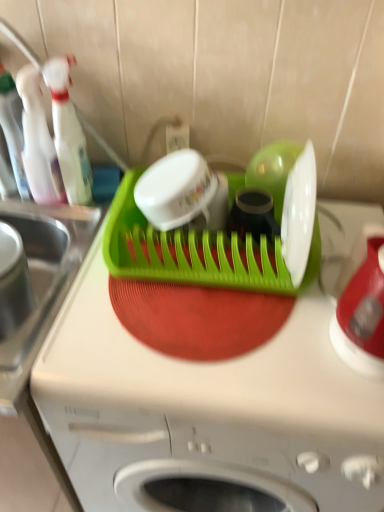
The width and height of the screenshot is (384, 512). What do you see at coordinates (207, 413) in the screenshot? I see `green plastic dish rack at center` at bounding box center [207, 413].

The image size is (384, 512). Describe the element at coordinates (212, 237) in the screenshot. I see `green plastic dish rack at center, placed as the second appliance when sorted from right to left` at that location.

In order to face green plastic dish rack at center, placed as the second appliance when sorted from right to left, should I rotate leftwards or rightwards?

To face it directly, rotate right by 3.211 degrees.

This screenshot has width=384, height=512. Describe the element at coordinates (68, 132) in the screenshot. I see `transparent plastic spray bottle at upper left, which ranks as the 3th bottle in left-to-right order` at that location.

Identify the location of transparent plastic spray bottle at upper left, the first bottle viewed from the right. pos(68,132).

What do you see at coordinates (362, 313) in the screenshot?
I see `red glossy kettle at right, placed as the 1th appliance when sorted from right to left` at bounding box center [362, 313].

Where is `red glossy kettle at right, placed as the 1th appliance when sorted from right to left`? This screenshot has width=384, height=512. red glossy kettle at right, placed as the 1th appliance when sorted from right to left is located at coordinates (362, 313).

Find the location of a particular element. The image size is (384, 512). brushed metal sink at left is located at coordinates (46, 264).

Measure the distance from green plastic dish rack at center to transparent plastic spray bottle at upper left, which ranks as the 3th bottle in left-to-right order.

A distance of 50.55 centimeters exists between green plastic dish rack at center and transparent plastic spray bottle at upper left, which ranks as the 3th bottle in left-to-right order.

From a real-world perspective, is green plastic dish rack at center under transparent plastic spray bottle at upper left, the first bottle viewed from the right?

Yes, from a real-world perspective, green plastic dish rack at center is under transparent plastic spray bottle at upper left, the first bottle viewed from the right.

Is green plastic dish rack at center not close to transparent plastic spray bottle at upper left, which ranks as the 3th bottle in left-to-right order?

No, there isn't a large distance between green plastic dish rack at center and transparent plastic spray bottle at upper left, which ranks as the 3th bottle in left-to-right order.

Is green plastic dish rack at center to the left or to the right of transparent plastic spray bottle at upper left, the first bottle viewed from the right, in the image?

green plastic dish rack at center is to the right of transparent plastic spray bottle at upper left, the first bottle viewed from the right.

Looking at this image, from a real-world perspective, who is located higher, green plastic dish rack at center, placed as the second appliance when sorted from right to left, or translucent plastic bottle at left, which is the second bottle from left to right?

In real-world perspective, translucent plastic bottle at left, which is the second bottle from left to right, is above.

Does green plastic dish rack at center, the 1th appliance positioned from the left, have a lesser width compared to translucent plastic bottle at left, which is the second bottle from left to right?

Incorrect, the width of green plastic dish rack at center, the 1th appliance positioned from the left, is not less than that of translucent plastic bottle at left, which is the second bottle from left to right.

Does green plastic dish rack at center, placed as the second appliance when sorted from right to left, have a larger size compared to translucent plastic bottle at left, which is counted as the second bottle, starting from the right?

Yes.

Where is `the 2nd appliance directly beneath the translucent plastic bottle at left, which is the second bottle from left to right (from a real-world perspective)`? The image size is (384, 512). the 2nd appliance directly beneath the translucent plastic bottle at left, which is the second bottle from left to right (from a real-world perspective) is located at coordinates (212, 237).

What's the angular difference between brushed metal sink at left and green plastic dish rack at center's facing directions?

The angular difference between brushed metal sink at left and green plastic dish rack at center is 0.000469 degrees.

Does point (13, 357) appear closer or farther from the camera than point (337, 432)?

Point (13, 357) appears to be farther away from the viewer than point (337, 432).

Does brushed metal sink at left turn towards green plastic dish rack at center?

No, brushed metal sink at left is not facing towards green plastic dish rack at center.

Is brushed metal sink at left next to green plastic dish rack at center?

No, brushed metal sink at left is not beside green plastic dish rack at center.

Which of these two, translucent plastic bottle at left, which is counted as the second bottle, starting from the right, or transparent plastic spray bottle at upper left, which ranks as the 3th bottle in left-to-right order, stands shorter?

translucent plastic bottle at left, which is counted as the second bottle, starting from the right.

Is translucent plastic bottle at left, which is the second bottle from left to right, far away from transparent plastic spray bottle at upper left, the first bottle viewed from the right?

No, there isn't a large distance between translucent plastic bottle at left, which is the second bottle from left to right, and transparent plastic spray bottle at upper left, the first bottle viewed from the right.

Is transparent plastic spray bottle at upper left, which ranks as the 3th bottle in left-to-right order, at the back of translucent plastic bottle at left, which is counted as the second bottle, starting from the right?

No, transparent plastic spray bottle at upper left, which ranks as the 3th bottle in left-to-right order, is not at the back of translucent plastic bottle at left, which is counted as the second bottle, starting from the right.

Does point (77, 195) appear closer or farther from the camera than point (376, 257)?

Point (77, 195) is farther from the camera than point (376, 257).

What's the angular difference between transparent plastic spray bottle at upper left, which ranks as the 3th bottle in left-to-right order, and red glossy kettle at right, placed as the 1th appliance when sorted from right to left,'s facing directions?

The angular difference between transparent plastic spray bottle at upper left, which ranks as the 3th bottle in left-to-right order, and red glossy kettle at right, placed as the 1th appliance when sorted from right to left, is 0.14 degrees.

Relative to red glossy kettle at right, the 2th appliance positioned from the left, is transparent plastic spray bottle at upper left, which ranks as the 3th bottle in left-to-right order, in front or behind?

transparent plastic spray bottle at upper left, which ranks as the 3th bottle in left-to-right order, is behind red glossy kettle at right, the 2th appliance positioned from the left.

Looking at this image, from the image's perspective, is transparent plastic spray bottle at upper left, which ranks as the 3th bottle in left-to-right order, located beneath red glossy kettle at right, the 2th appliance positioned from the left?

Actually, transparent plastic spray bottle at upper left, which ranks as the 3th bottle in left-to-right order, appears above red glossy kettle at right, the 2th appliance positioned from the left, in the image.

Can you confirm if transparent plastic spray bottle at upper left, which ranks as the 3th bottle in left-to-right order, is thinner than translucent plastic bottle at left, which is counted as the second bottle, starting from the right?

No, transparent plastic spray bottle at upper left, which ranks as the 3th bottle in left-to-right order, is not thinner than translucent plastic bottle at left, which is counted as the second bottle, starting from the right.

Looking at the image, does transparent plastic spray bottle at upper left, which ranks as the 3th bottle in left-to-right order, seem bigger or smaller compared to translucent plastic bottle at left, which is the second bottle from left to right?

transparent plastic spray bottle at upper left, which ranks as the 3th bottle in left-to-right order, is bigger than translucent plastic bottle at left, which is the second bottle from left to right.

Where is `bottle that is in front of the translucent plastic bottle at left, which is the second bottle from left to right`? Image resolution: width=384 pixels, height=512 pixels. bottle that is in front of the translucent plastic bottle at left, which is the second bottle from left to right is located at coordinates click(68, 132).

From the image's perspective, which one is positioned lower, transparent plastic bottle at left, the third bottle positioned from the right, or translucent plastic bottle at left, which is counted as the second bottle, starting from the right?

translucent plastic bottle at left, which is counted as the second bottle, starting from the right.

Where is `bottle behind the translucent plastic bottle at left, which is counted as the second bottle, starting from the right`? The width and height of the screenshot is (384, 512). bottle behind the translucent plastic bottle at left, which is counted as the second bottle, starting from the right is located at coordinates (13, 129).

From the picture: Is transparent plastic bottle at left, the third bottle positioned from the right, behind translucent plastic bottle at left, which is counted as the second bottle, starting from the right?

That is True.

From the picture: How different are the orientations of transparent plastic bottle at left, arranged as the 1th bottle when viewed from the left, and translucent plastic bottle at left, which is counted as the second bottle, starting from the right, in degrees?

0.000612 degrees.

In order to click on bottle that is the 1st one when counting backward from the green plastic dish rack at center in this screenshot , I will do `click(68, 132)`.

Locate an element on the screen. The width and height of the screenshot is (384, 512). appliance that is the 1st one when counting downward from the translucent plastic bottle at left, which is the second bottle from left to right (from the image's perspective) is located at coordinates (212, 237).

Estimate the real-world distances between objects in this image. Which object is closer to brushed metal sink at left, transparent plastic bottle at left, arranged as the 1th bottle when viewed from the left, or red glossy kettle at right, the 2th appliance positioned from the left?

Based on the image, transparent plastic bottle at left, arranged as the 1th bottle when viewed from the left, appears to be nearer to brushed metal sink at left.

Looking at the image, which one is located closer to transparent plastic bottle at left, arranged as the 1th bottle when viewed from the left, transparent plastic spray bottle at upper left, the first bottle viewed from the right, or green plastic dish rack at center, the 1th appliance positioned from the left?

transparent plastic spray bottle at upper left, the first bottle viewed from the right.

Considering their positions, is red glossy kettle at right, placed as the 1th appliance when sorted from right to left, positioned closer to brushed metal sink at left than transparent plastic bottle at left, the third bottle positioned from the right?

Based on the image, transparent plastic bottle at left, the third bottle positioned from the right, appears to be nearer to brushed metal sink at left.

Which object lies nearer to the anchor point green plastic dish rack at center, the 1th appliance positioned from the left, transparent plastic bottle at left, the third bottle positioned from the right, or brushed metal sink at left?

Among the two, brushed metal sink at left is located nearer to green plastic dish rack at center, the 1th appliance positioned from the left.

When comparing their distances from brushed metal sink at left, does green plastic dish rack at center, placed as the second appliance when sorted from right to left, or transparent plastic spray bottle at upper left, the first bottle viewed from the right, seem further?

Among the two, green plastic dish rack at center, placed as the second appliance when sorted from right to left, is located further to brushed metal sink at left.

Looking at the image, which one is located further to green plastic dish rack at center, translucent plastic bottle at left, which is the second bottle from left to right, or transparent plastic spray bottle at upper left, the first bottle viewed from the right?

translucent plastic bottle at left, which is the second bottle from left to right, is further to green plastic dish rack at center.

When comparing their distances from translucent plastic bottle at left, which is counted as the second bottle, starting from the right, does brushed metal sink at left or green plastic dish rack at center, placed as the second appliance when sorted from right to left, seem further?

Based on the image, green plastic dish rack at center, placed as the second appliance when sorted from right to left, appears to be further to translucent plastic bottle at left, which is counted as the second bottle, starting from the right.

Which object lies nearer to the anchor point green plastic dish rack at center, translucent plastic bottle at left, which is the second bottle from left to right, or brushed metal sink at left?

Among the two, brushed metal sink at left is located nearer to green plastic dish rack at center.

Locate an element on the screen. The height and width of the screenshot is (512, 384). home appliance between brushed metal sink at left and red glossy kettle at right, placed as the 1th appliance when sorted from right to left is located at coordinates (207, 413).

The height and width of the screenshot is (512, 384). I want to click on appliance between brushed metal sink at left and red glossy kettle at right, the 2th appliance positioned from the left, in the horizontal direction, so click(212, 237).

You are a GUI agent. You are given a task and a screenshot of the screen. Output one action in this format:
    pyautogui.click(x=<x>, y=<y>)
    Task: Click on the sink between transparent plastic bottle at left, the third bottle positioned from the right, and green plastic dish rack at center from top to bottom
    The image size is (384, 512).
    Given the screenshot: What is the action you would take?
    pyautogui.click(x=46, y=264)

Identify the location of appliance located between transparent plastic spray bottle at upper left, which ranks as the 3th bottle in left-to-right order, and red glossy kettle at right, the 2th appliance positioned from the left, in the left-right direction. This screenshot has height=512, width=384. (212, 237).